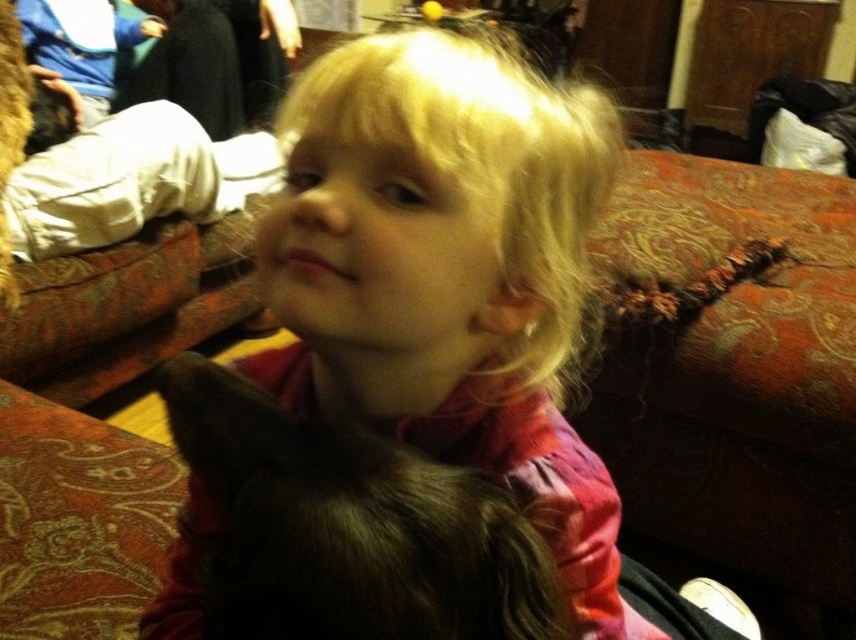
From the picture: Who is higher up, smooth pink shirt at center or dark fur cat at center?

Positioned higher is dark fur cat at center.

Does smooth pink shirt at center appear on the right side of dark fur cat at center?

Correct, you'll find smooth pink shirt at center to the right of dark fur cat at center.

Is point (182, 582) less distant than point (171, 372)?

No, it is behind (171, 372).

This screenshot has width=856, height=640. Identify the location of smooth pink shirt at center. (456, 284).